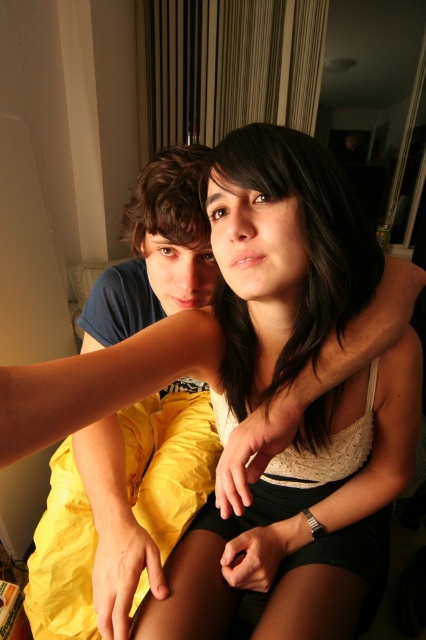
Question: Can you confirm if matte blue shirt at left is positioned above smooth dark hair at center?

Choices:
 (A) no
 (B) yes

Answer: (A)

Question: Which point appears closest to the camera in this image?

Choices:
 (A) (313, 358)
 (B) (164, 268)

Answer: (A)

Question: Where is matte blue shirt at left located in relation to smooth dark hair at center in the image?

Choices:
 (A) left
 (B) right

Answer: (A)

Question: Which object is closer to the camera taking this photo?

Choices:
 (A) matte blue shirt at left
 (B) smooth dark hair at center

Answer: (B)

Question: Does matte blue shirt at left have a greater width compared to smooth dark hair at center?

Choices:
 (A) yes
 (B) no

Answer: (A)